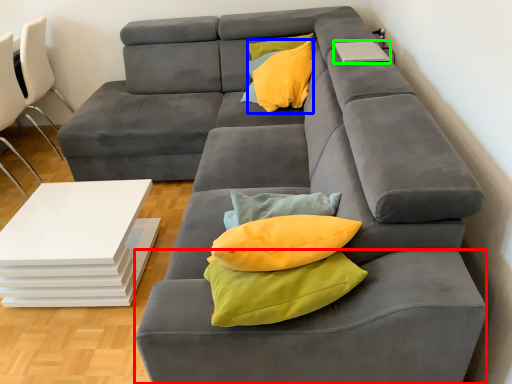
Question: Considering the real-world distances, which object is farthest from footrest (highlighted by a red box)? throw pillow (highlighted by a blue box) or laptop (highlighted by a green box)?

Choices:
 (A) throw pillow
 (B) laptop

Answer: (A)